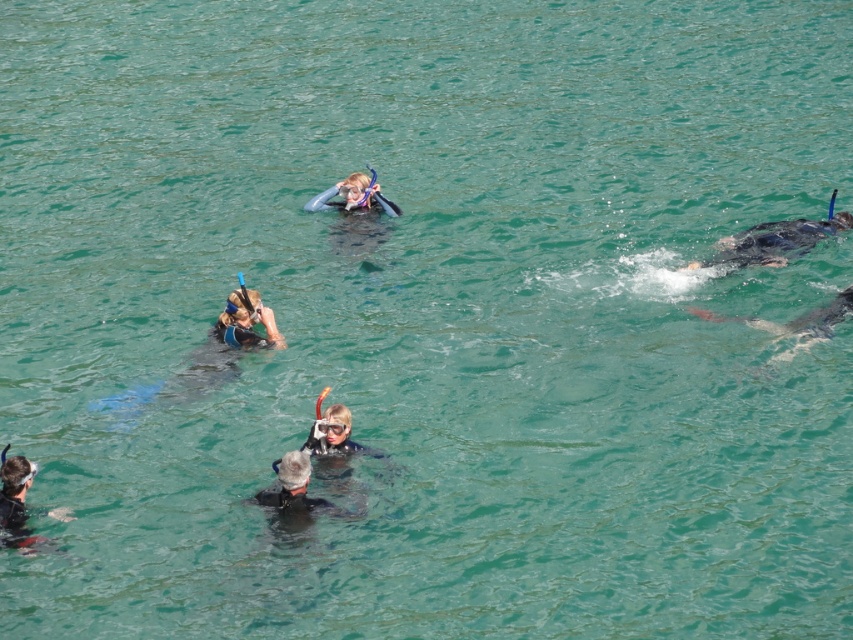
Question: Considering the relative positions of black rubber snorkeling gear at center and matte black snorkeling gear at center in the image provided, where is black rubber snorkeling gear at center located with respect to matte black snorkeling gear at center?

Choices:
 (A) right
 (B) left

Answer: (B)

Question: Does smooth gray shark at right have a smaller size compared to matte black snorkel gear at lower left?

Choices:
 (A) no
 (B) yes

Answer: (A)

Question: Which of the following is the farthest from the observer?

Choices:
 (A) smooth gray shark at right
 (B) black rubber snorkel at right

Answer: (B)

Question: Which of the following is the closest to the observer?

Choices:
 (A) tap(701, 262)
 (B) tap(4, 545)
 (C) tap(296, 483)

Answer: (B)

Question: Which point is farther to the camera?

Choices:
 (A) (779, 220)
 (B) (357, 182)

Answer: (B)

Question: Does black rubber snorkel at right have a larger size compared to matte black snorkel gear at lower left?

Choices:
 (A) yes
 (B) no

Answer: (A)